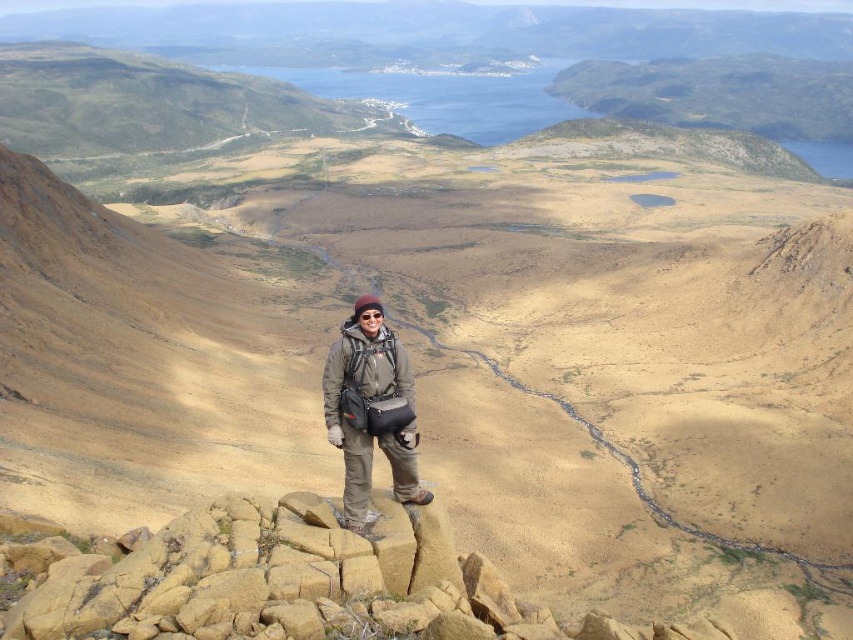
Is point (297, 593) closer to camera compared to point (364, 420)?

Yes, it is.

Locate an element on the screen. yellow rock at center is located at coordinates (296, 582).

Consider the image. Who is more distant from viewer, (157,544) or (350,524)?

The point (350,524) is behind.

I want to click on yellow rock at center, so coord(296,582).